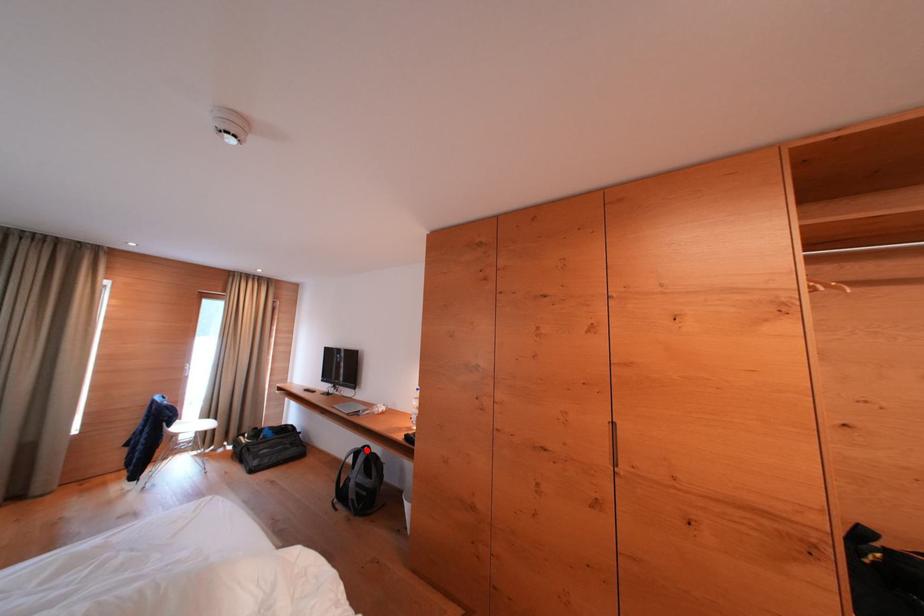
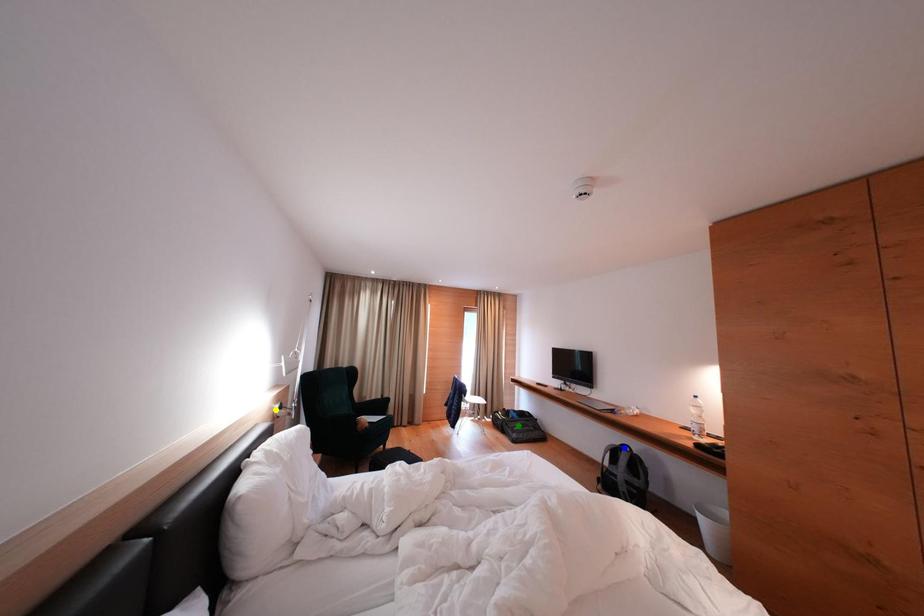
Question: I am providing you with two images of the same scene from different viewpoints. A red point is marked on the first image. You are given multiple points on the second image. Can you choose the point in image 2 that corresponds to the point in image 1?

Choices:
 (A) green point
 (B) blue point
 (C) yellow point

Answer: (B)